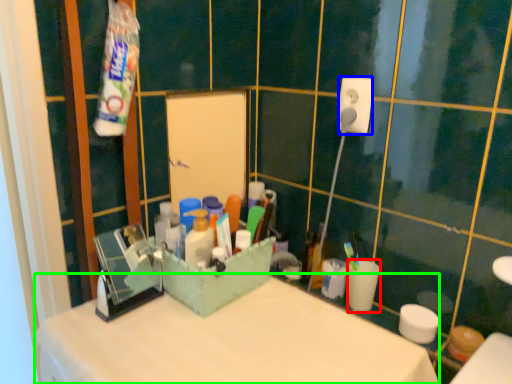
Question: Which object is positioned closest to coffee cup (highlighted by a red box)? Select from power plugs and sockets (highlighted by a blue box) and counter top (highlighted by a green box).

Choices:
 (A) power plugs and sockets
 (B) counter top

Answer: (B)